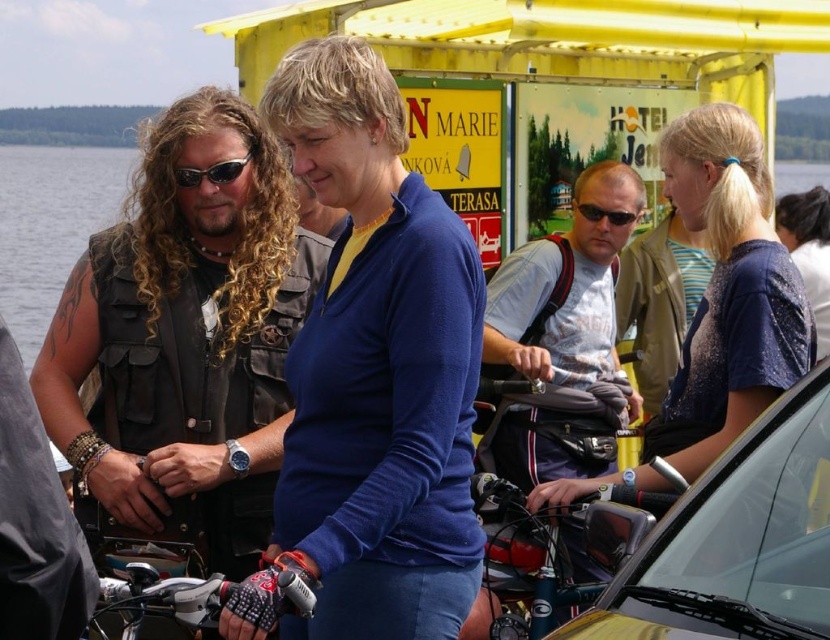
Question: Can you confirm if light gray t-shirt at center is positioned to the right of transparent water at center?

Choices:
 (A) no
 (B) yes

Answer: (B)

Question: Considering the real-world distances, which object is closest to the transparent water at center?

Choices:
 (A) blue matte shirt at center
 (B) sparkly blue shirt at center
 (C) black plastic sunglasses at center
 (D) metallic gold car at center

Answer: (C)

Question: Does metallic gold car at center appear over sunglasses at left?

Choices:
 (A) no
 (B) yes

Answer: (A)

Question: Is metallic gold car at center bigger than blue fabric shirt at center?

Choices:
 (A) no
 (B) yes

Answer: (B)

Question: Among these objects, which one is nearest to the camera?

Choices:
 (A) leather vest at center
 (B) black plastic sunglasses at center

Answer: (A)

Question: Which point is closer to the camera?

Choices:
 (A) blue matte shirt at center
 (B) sparkly blue shirt at center
 (C) transparent water at center

Answer: (A)